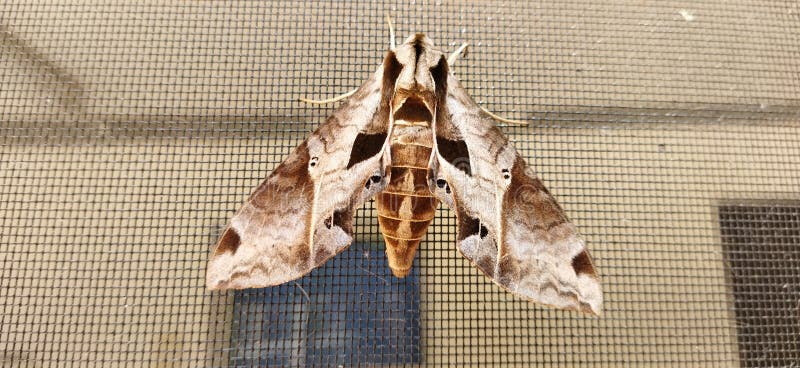
Identify the location of door. (740, 272).